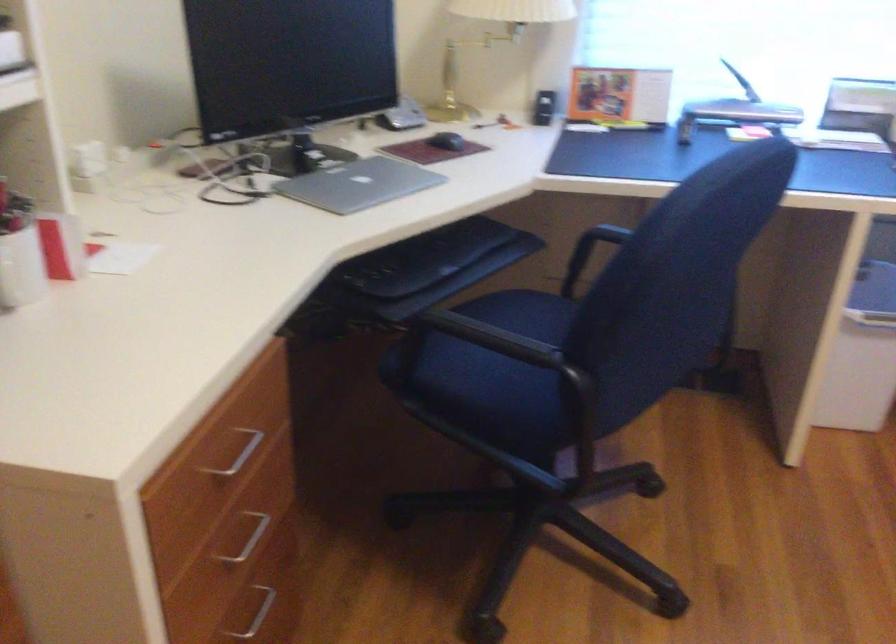
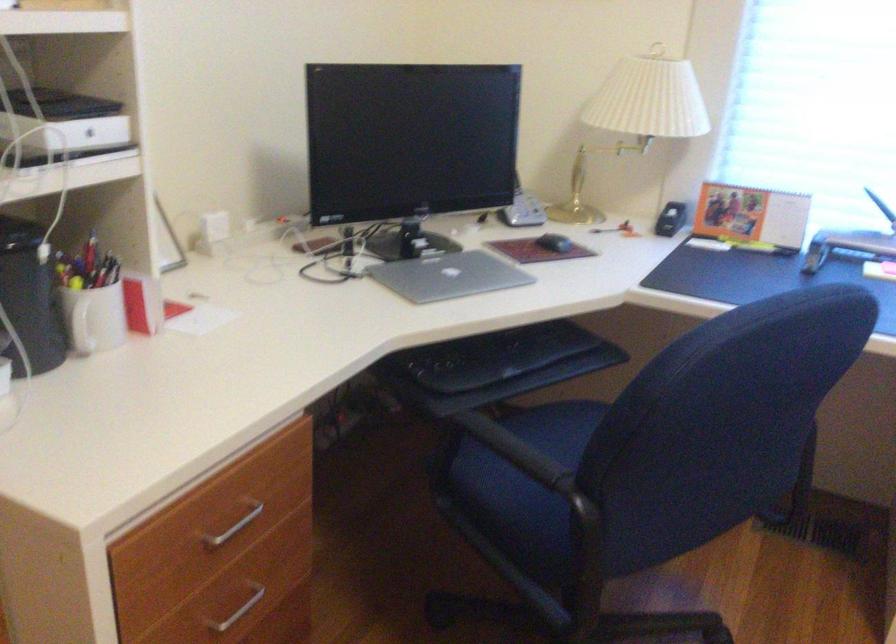
Locate, in the second image, the point that corresponds to [448,140] in the first image.

(554, 243)